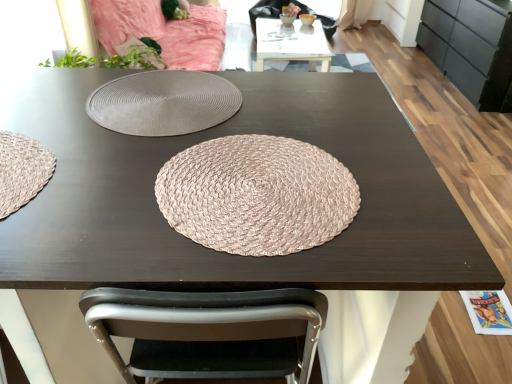
Question: Is white glossy table at upper center completely or partially outside of matte black dresser at right?

Choices:
 (A) no
 (B) yes

Answer: (B)

Question: Would you consider white glossy table at upper center to be distant from matte black dresser at right?

Choices:
 (A) no
 (B) yes

Answer: (B)

Question: From the image's perspective, is white glossy table at upper center above matte black dresser at right?

Choices:
 (A) yes
 (B) no

Answer: (B)

Question: Is white glossy table at upper center turned away from matte black dresser at right?

Choices:
 (A) yes
 (B) no

Answer: (B)

Question: Can you confirm if white glossy table at upper center is wider than matte black dresser at right?

Choices:
 (A) yes
 (B) no

Answer: (A)

Question: Is white glossy table at upper center thinner than matte black dresser at right?

Choices:
 (A) no
 (B) yes

Answer: (A)

Question: Is the position of matte black dresser at right more distant than that of pink woven mat at center?

Choices:
 (A) yes
 (B) no

Answer: (A)

Question: Considering the relative sizes of matte black dresser at right and pink woven mat at center in the image provided, is matte black dresser at right wider than pink woven mat at center?

Choices:
 (A) yes
 (B) no

Answer: (A)

Question: Does matte black dresser at right touch pink woven mat at center?

Choices:
 (A) no
 (B) yes

Answer: (A)

Question: Considering the relative positions of matte black dresser at right and pink woven mat at center in the image provided, is matte black dresser at right to the left of pink woven mat at center from the viewer's perspective?

Choices:
 (A) yes
 (B) no

Answer: (B)

Question: From the image's perspective, does matte black dresser at right appear higher than pink woven mat at center?

Choices:
 (A) yes
 (B) no

Answer: (A)

Question: Can you confirm if matte black dresser at right is bigger than pink woven mat at center?

Choices:
 (A) yes
 (B) no

Answer: (A)

Question: Is the depth of white glossy table at upper center less than that of pink woven mat at center?

Choices:
 (A) no
 (B) yes

Answer: (A)